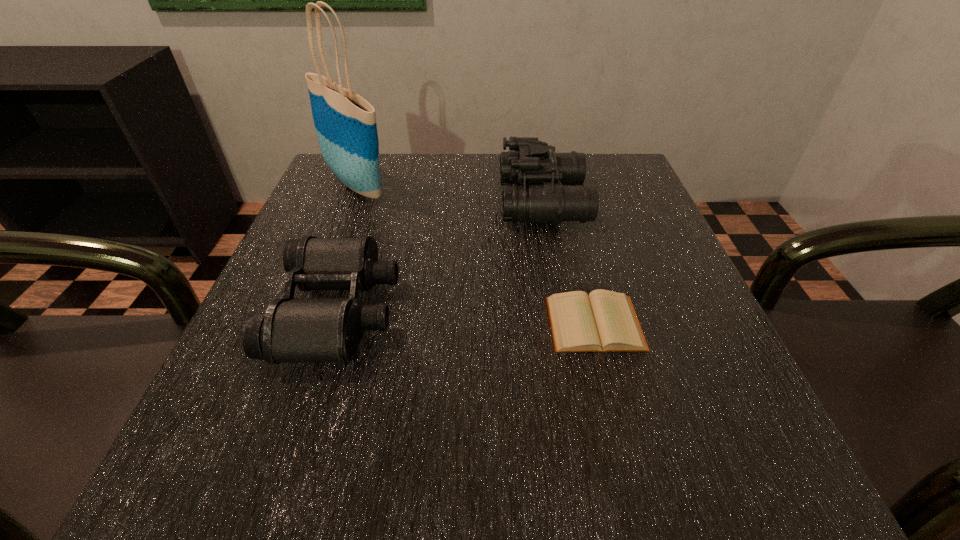
You are a GUI agent. You are given a task and a screenshot of the screen. Output one action in this format:
    pyautogui.click(x=<x>, y=<y>)
    Task: Click on the free space located 0.150m through the eyepieces of the shorter binoculars
    The width and height of the screenshot is (960, 540).
    Given the screenshot: What is the action you would take?
    pyautogui.click(x=487, y=310)

Image resolution: width=960 pixels, height=540 pixels. I want to click on free space located on the left of the shortest object, so click(304, 323).

Locate an element on the screen. This screenshot has height=540, width=960. tote bag that is positioned at the far edge is located at coordinates (345, 123).

This screenshot has height=540, width=960. In order to click on binoculars that is at the far edge in this screenshot , I will do `click(542, 199)`.

I want to click on tote bag situated at the left edge, so click(x=345, y=123).

Where is `binoculars that is at the left edge`? The width and height of the screenshot is (960, 540). binoculars that is at the left edge is located at coordinates (293, 329).

Where is `binoculars situated at the right edge`? The height and width of the screenshot is (540, 960). binoculars situated at the right edge is located at coordinates (542, 199).

At what (x,y) coordinates should I click in order to perform the action: click on diary that is at the right edge. Please return your answer as a coordinate pair (x, y). This screenshot has width=960, height=540. Looking at the image, I should click on (604, 321).

Image resolution: width=960 pixels, height=540 pixels. What are the coordinates of `object present at the far left corner` in the screenshot? It's located at (345, 123).

Locate an element on the screen. The image size is (960, 540). object positioned at the far right corner is located at coordinates (542, 199).